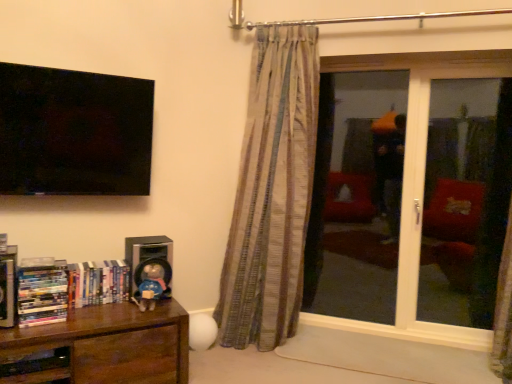
The image size is (512, 384). What do you see at coordinates (7, 283) in the screenshot? I see `hardcover book at left, the 3th book viewed from the right` at bounding box center [7, 283].

Where is `transparent glass door at right`? This screenshot has height=384, width=512. transparent glass door at right is located at coordinates (417, 185).

In order to face brown wood bookcase at lower left, should I rotate leftwards or rightwards?

You should look left and rotate roughly 20.868 degrees.

Image resolution: width=512 pixels, height=384 pixels. Describe the element at coordinates (272, 192) in the screenshot. I see `striped fabric curtain at center` at that location.

At what (x,y) coordinates should I click in order to perform the action: click on matte blue plush at lower left. Please return your answer as a coordinate pair (x, y). Looking at the image, I should click on (151, 283).

Which is farther from the camera, (27, 267) or (99, 347)?

Positioned behind is point (99, 347).

Identify the location of bookcase that appears below the multicolored plastic books at lower left, the second book in the right-to-left sequence (from a real-world perspective). The width and height of the screenshot is (512, 384). (93, 331).

Is multicolored plastic books at lower left, which appears as the 2th book when viewed from the left, inside the boundaries of brown wood bookcase at lower left, or outside?

multicolored plastic books at lower left, which appears as the 2th book when viewed from the left, cannot be found inside brown wood bookcase at lower left.

Is the position of multicolored plastic books at lower left, the second book in the right-to-left sequence, more distant than that of brown wood bookcase at lower left?

Yes, multicolored plastic books at lower left, the second book in the right-to-left sequence, is further from the viewer.

From the picture: From a real-world perspective, is clear glass screen door at center, which appears as the 2th screen door when viewed from the right, below matte blue plush at lower left?

Actually, clear glass screen door at center, which appears as the 2th screen door when viewed from the right, is physically above matte blue plush at lower left in the real world.

From the image's perspective, which is below, clear glass screen door at center, placed as the 1th screen door when sorted from left to right, or matte blue plush at lower left?

matte blue plush at lower left, from the image's perspective.

Between clear glass screen door at center, placed as the 1th screen door when sorted from left to right, and matte blue plush at lower left, which one has smaller width?

clear glass screen door at center, placed as the 1th screen door when sorted from left to right, is thinner.

Can you tell me how much transparent glass door at right and satin black speaker at lower left differ in facing direction?

46.7 degrees separate the facing orientations of transparent glass door at right and satin black speaker at lower left.

Which is behind, point (407, 246) or point (167, 291)?

The point (407, 246) is farther.

Is there a large distance between transparent glass door at right and satin black speaker at lower left?

Yes, transparent glass door at right and satin black speaker at lower left are quite far apart.

Is transparent glass door at right completely or partially outside of satin black speaker at lower left?

Yes, transparent glass door at right is outside of satin black speaker at lower left.

Which of these two, hardcover books at left, the 1th book viewed from the right, or satin black speaker at lower left, stands shorter?

Standing shorter between the two is hardcover books at left, the 1th book viewed from the right.

How many degrees apart are the facing directions of hardcover books at left, the 1th book viewed from the right, and satin black speaker at lower left?

There is a 1.61-degree angle between the facing directions of hardcover books at left, the 1th book viewed from the right, and satin black speaker at lower left.

Is hardcover books at left, the 1th book viewed from the right, bigger or smaller than satin black speaker at lower left?

In the image, hardcover books at left, the 1th book viewed from the right, appears to be smaller than satin black speaker at lower left.

Is hardcover books at left, the 1th book viewed from the right, turned away from satin black speaker at lower left?

No.

Is matte blue plush at lower left not inside transparent glass screen door at right, the second screen door viewed from the left?

Yes, matte blue plush at lower left is not within transparent glass screen door at right, the second screen door viewed from the left.

Considering the points (151, 296) and (504, 196), which point is behind, point (151, 296) or point (504, 196)?

Positioned behind is point (504, 196).

Could you tell me if matte blue plush at lower left is turned towards transparent glass screen door at right, marked as the first screen door in a right-to-left arrangement?

No, matte blue plush at lower left is not aimed at transparent glass screen door at right, marked as the first screen door in a right-to-left arrangement.

At what (x,y) coordinates should I click in order to perform the action: click on the 1st screen door behind the matte blue plush at lower left. Please return your answer as a coordinate pair (x, y). This screenshot has width=512, height=384. Looking at the image, I should click on (465, 200).

From a real-world perspective, is transparent glass door at right over clear glass screen door at center, placed as the 1th screen door when sorted from left to right?

Yes, from a real-world perspective, transparent glass door at right is over clear glass screen door at center, placed as the 1th screen door when sorted from left to right

Based on the photo, considering the relative positions of transparent glass door at right and clear glass screen door at center, which appears as the 2th screen door when viewed from the right, in the image provided, is transparent glass door at right to the left of clear glass screen door at center, which appears as the 2th screen door when viewed from the right, from the viewer's perspective?

In fact, transparent glass door at right is to the right of clear glass screen door at center, which appears as the 2th screen door when viewed from the right.

In terms of size, does transparent glass door at right appear bigger or smaller than clear glass screen door at center, placed as the 1th screen door when sorted from left to right?

Clearly, transparent glass door at right is larger in size than clear glass screen door at center, placed as the 1th screen door when sorted from left to right.

Can you tell me how much transparent glass door at right and clear glass screen door at center, which appears as the 2th screen door when viewed from the right, differ in facing direction?

The facing directions of transparent glass door at right and clear glass screen door at center, which appears as the 2th screen door when viewed from the right, are 0.181 degrees apart.

Considering the relative positions of matte blue plush at lower left and hardcover book at left, the 3th book viewed from the right, in the image provided, is matte blue plush at lower left to the left of hardcover book at left, the 3th book viewed from the right, from the viewer's perspective?

In fact, matte blue plush at lower left is to the right of hardcover book at left, the 3th book viewed from the right.

Which is closer to the camera, (143, 292) or (7, 249)?

Point (143, 292) is farther from the camera than point (7, 249).

Is matte blue plush at lower left bigger or smaller than hardcover book at left, positioned as the first book in left-to-right order?

matte blue plush at lower left is smaller than hardcover book at left, positioned as the first book in left-to-right order.

Based on the photo, can you confirm if matte blue plush at lower left is thinner than hardcover book at left, positioned as the first book in left-to-right order?

Correct, the width of matte blue plush at lower left is less than that of hardcover book at left, positioned as the first book in left-to-right order.

Locate an element on the screen. The image size is (512, 384). bookcase located underneath the multicolored plastic books at lower left, which appears as the 2th book when viewed from the left (from a real-world perspective) is located at coordinates (93, 331).

From the matte blue plush at lower left, count 1st screen door to the right and point to it. Please provide its 2D coordinates.

[(356, 197)]

Estimate the real-world distances between objects in this image. Which object is further from satin black speaker at lower left, clear glass screen door at center, placed as the 1th screen door when sorted from left to right, or brown wood bookcase at lower left?

clear glass screen door at center, placed as the 1th screen door when sorted from left to right, is positioned further to the anchor satin black speaker at lower left.

Based on their spatial positions, is satin black speaker at lower left or brown wood bookcase at lower left closer to transparent glass screen door at right, the second screen door viewed from the left?

brown wood bookcase at lower left lies closer to transparent glass screen door at right, the second screen door viewed from the left, than the other object.

Which object lies nearer to the anchor point transparent glass screen door at right, marked as the first screen door in a right-to-left arrangement, transparent glass door at right or striped fabric curtain at center?

Among the two, transparent glass door at right is located nearer to transparent glass screen door at right, marked as the first screen door in a right-to-left arrangement.

Estimate the real-world distances between objects in this image. Which object is further from clear glass screen door at center, placed as the 1th screen door when sorted from left to right, hardcover books at left, the 1th book viewed from the right, or transparent glass door at right?

hardcover books at left, the 1th book viewed from the right.

From the picture: Considering their positions, is hardcover books at left, the 1th book viewed from the right, positioned closer to satin black speaker at lower left than multicolored plastic books at lower left, which appears as the 2th book when viewed from the left?

hardcover books at left, the 1th book viewed from the right, is closer to satin black speaker at lower left.

Which object lies nearer to the anchor point transparent glass screen door at right, the second screen door viewed from the left, striped fabric curtain at center or hardcover book at left, the 3th book viewed from the right?

striped fabric curtain at center is positioned closer to the anchor transparent glass screen door at right, the second screen door viewed from the left.

Which object lies further to the anchor point transparent glass screen door at right, marked as the first screen door in a right-to-left arrangement, clear glass screen door at center, placed as the 1th screen door when sorted from left to right, or matte blue plush at lower left?

matte blue plush at lower left lies further to transparent glass screen door at right, marked as the first screen door in a right-to-left arrangement, than the other object.

When comparing their distances from multicolored plastic books at lower left, which appears as the 2th book when viewed from the left, does hardcover book at left, positioned as the first book in left-to-right order, or matte blue plush at lower left seem closer?

The object closer to multicolored plastic books at lower left, which appears as the 2th book when viewed from the left, is hardcover book at left, positioned as the first book in left-to-right order.

Where is `bookcase between hardcover book at left, the 3th book viewed from the right, and clear glass screen door at center, which appears as the 2th screen door when viewed from the right, in the horizontal direction`? This screenshot has width=512, height=384. bookcase between hardcover book at left, the 3th book viewed from the right, and clear glass screen door at center, which appears as the 2th screen door when viewed from the right, in the horizontal direction is located at coordinates (93, 331).

In order to click on toy between hardcover books at left, marked as the 3th book in a left-to-right arrangement, and transparent glass screen door at right, the second screen door viewed from the left, in the horizontal direction in this screenshot , I will do `click(151, 283)`.

Locate an element on the screen. curtain between brown wood bookcase at lower left and transparent glass door at right is located at coordinates (272, 192).

Where is `screen door between multicolored plastic books at lower left, which appears as the 2th book when viewed from the left, and transparent glass screen door at right, marked as the first screen door in a right-to-left arrangement, from left to right`? Image resolution: width=512 pixels, height=384 pixels. screen door between multicolored plastic books at lower left, which appears as the 2th book when viewed from the left, and transparent glass screen door at right, marked as the first screen door in a right-to-left arrangement, from left to right is located at coordinates (356, 197).